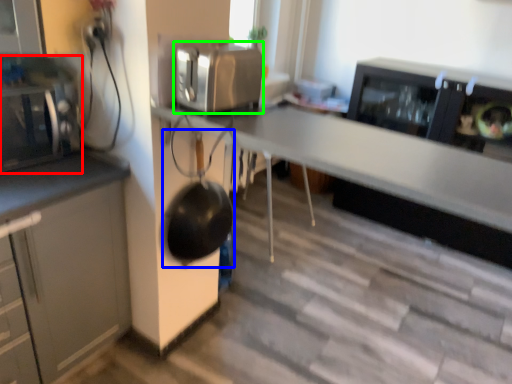
Question: Which is farther away from home appliance (highlighted by a red box)? wok (highlighted by a blue box) or kitchen appliance (highlighted by a green box)?

Choices:
 (A) wok
 (B) kitchen appliance

Answer: (B)